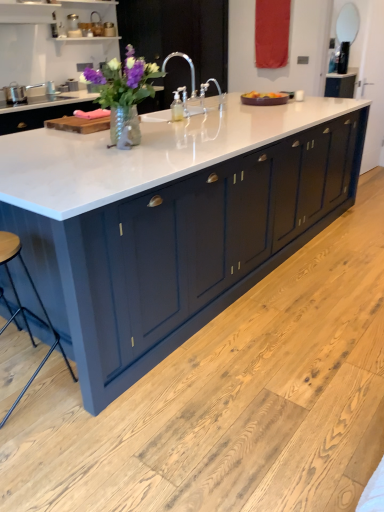
Question: From the image's perspective, is white marble countertop at center under matte glass vase at center?

Choices:
 (A) yes
 (B) no

Answer: (A)

Question: Considering the relative positions of white marble countertop at center and matte glass vase at center in the image provided, is white marble countertop at center in front of matte glass vase at center?

Choices:
 (A) no
 (B) yes

Answer: (B)

Question: Does white marble countertop at center turn towards matte glass vase at center?

Choices:
 (A) yes
 (B) no

Answer: (B)

Question: From a real-world perspective, is white marble countertop at center on matte glass vase at center?

Choices:
 (A) yes
 (B) no

Answer: (B)

Question: Can you confirm if white marble countertop at center is shorter than matte glass vase at center?

Choices:
 (A) yes
 (B) no

Answer: (B)

Question: Based on their sizes in the image, would you say white marble countertop at center is bigger or smaller than wooden seat at lower left?

Choices:
 (A) big
 (B) small

Answer: (A)

Question: Is point (99, 152) positioned closer to the camera than point (6, 240)?

Choices:
 (A) closer
 (B) farther

Answer: (B)

Question: Is white marble countertop at center inside the boundaries of wooden seat at lower left, or outside?

Choices:
 (A) inside
 (B) outside

Answer: (B)

Question: From a real-world perspective, relative to wooden seat at lower left, is white marble countertop at center vertically above or below?

Choices:
 (A) below
 (B) above

Answer: (B)

Question: Would you say matte glass vase at center is to the left or to the right of wooden seat at lower left in the picture?

Choices:
 (A) right
 (B) left

Answer: (A)

Question: From a real-world perspective, is matte glass vase at center above or below wooden seat at lower left?

Choices:
 (A) above
 (B) below

Answer: (A)

Question: Looking at the image, does matte glass vase at center seem bigger or smaller compared to wooden seat at lower left?

Choices:
 (A) big
 (B) small

Answer: (B)

Question: Is matte glass vase at center situated inside wooden seat at lower left or outside?

Choices:
 (A) inside
 (B) outside

Answer: (B)

Question: In terms of width, does matte glass vase at center look wider or thinner when compared to satin nickel faucet at center?

Choices:
 (A) thin
 (B) wide

Answer: (A)

Question: Based on their positions, is matte glass vase at center located to the left or right of satin nickel faucet at center?

Choices:
 (A) left
 (B) right

Answer: (A)